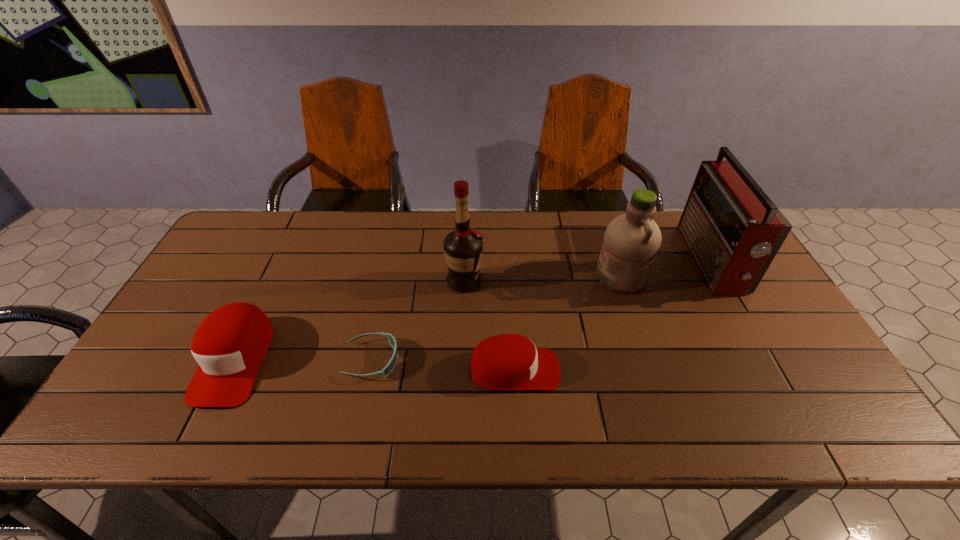
Identify the location of object located at the left edge. The image size is (960, 540). (230, 344).

This screenshot has width=960, height=540. I want to click on object located in the right edge section of the desktop, so click(733, 230).

Where is `object present at the near left corner`? object present at the near left corner is located at coordinates (230, 344).

I want to click on object that is at the far right corner, so click(733, 230).

Where is `vacant space at the far edge of the desktop`? This screenshot has width=960, height=540. vacant space at the far edge of the desktop is located at coordinates (404, 229).

The width and height of the screenshot is (960, 540). What are the coordinates of `free region at the near edge of the desktop` in the screenshot? It's located at (606, 392).

This screenshot has height=540, width=960. In order to click on free region at the right edge of the desktop in this screenshot , I will do `click(753, 347)`.

Find the location of a particular element. Image resolution: width=960 pixels, height=540 pixels. free space at the far left corner of the desktop is located at coordinates (260, 245).

At what (x,y) coordinates should I click in order to perform the action: click on free space at the near left corner. Please return your answer as a coordinate pair (x, y). Looking at the image, I should click on (150, 372).

Identify the location of vacant area at the near right corner of the desktop. (769, 377).